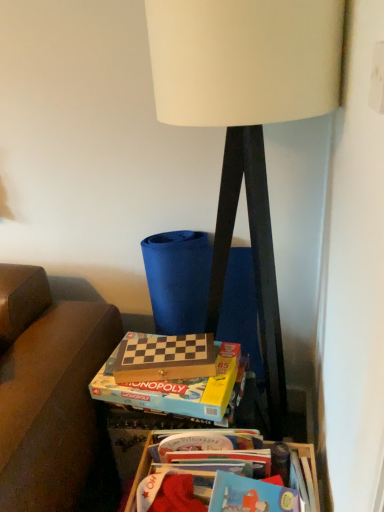
What do you see at coordinates (246, 117) in the screenshot?
I see `white matte lamp at center` at bounding box center [246, 117].

What do you see at coordinates (165, 358) in the screenshot? I see `wooden chess set at lower center, which is the 2th paperback book from front to back` at bounding box center [165, 358].

The image size is (384, 512). Identify the location of wooden at lower right. (140, 472).

In the scene shown: Considering the relative sizes of wooden at lower right and wooden chess set at lower center, which is the 2th paperback book from front to back, in the image provided, is wooden at lower right smaller than wooden chess set at lower center, which is the 2th paperback book from front to back,?

Actually, wooden at lower right might be larger than wooden chess set at lower center, which is the 2th paperback book from front to back.

Looking at this image, from a real-world perspective, is wooden at lower right physically below wooden chess set at lower center, which appears as the first paperback book when viewed from the back?

Yes, from a real-world perspective, wooden at lower right is under wooden chess set at lower center, which appears as the first paperback book when viewed from the back.

Which object is further away from the camera, wooden at lower right or wooden chess set at lower center, which appears as the first paperback book when viewed from the back?

wooden chess set at lower center, which appears as the first paperback book when viewed from the back, is further away from the camera.

Is wooden at lower right to the left of wooden chess set at lower center, which appears as the first paperback book when viewed from the back, from the viewer's perspective?

No, wooden at lower right is not to the left of wooden chess set at lower center, which appears as the first paperback book when viewed from the back.

Considering the relative sizes of white matte lamp at center and wooden at lower right in the image provided, is white matte lamp at center wider than wooden at lower right?

Yes, white matte lamp at center is wider than wooden at lower right.

From a real-world perspective, is white matte lamp at center positioned under wooden at lower right based on gravity?

No, from a real-world perspective, white matte lamp at center is not under wooden at lower right.

From the image's perspective, is white matte lamp at center located beneath wooden at lower right?

Incorrect, from the image's perspective, white matte lamp at center is higher than wooden at lower right.

What's the angular difference between white matte lamp at center and wooden at lower right's facing directions?

white matte lamp at center and wooden at lower right are facing 2.39 degrees away from each other.

Considering the positions of objects white matte lamp at center and wooden chess set at lower center, which appears as the first paperback book when viewed from the back, in the image provided, who is in front, white matte lamp at center or wooden chess set at lower center, which appears as the first paperback book when viewed from the back,?

Result: white matte lamp at center is closer to the camera.

Is white matte lamp at center inside or outside of wooden chess set at lower center, which appears as the first paperback book when viewed from the back?

white matte lamp at center is not inside wooden chess set at lower center, which appears as the first paperback book when viewed from the back, it's outside.

From a real-world perspective, which object stands above the other?

white matte lamp at center.

Between wooden chess set at center, the 1th paperback book in the front-to-back sequence, and white matte lamp at center, which one is positioned in front?

white matte lamp at center is more forward.

Considering the relative sizes of wooden chess set at center, the 1th paperback book in the front-to-back sequence, and white matte lamp at center in the image provided, is wooden chess set at center, the 1th paperback book in the front-to-back sequence, bigger than white matte lamp at center?

No, wooden chess set at center, the 1th paperback book in the front-to-back sequence, is not bigger than white matte lamp at center.

How far apart are wooden chess set at center, the 1th paperback book in the front-to-back sequence, and white matte lamp at center?

The distance of wooden chess set at center, the 1th paperback book in the front-to-back sequence, from white matte lamp at center is 16.75 inches.

Is wooden chess set at center, the 1th paperback book in the front-to-back sequence, taller or shorter than white matte lamp at center?

Considering their sizes, wooden chess set at center, the 1th paperback book in the front-to-back sequence, has less height than white matte lamp at center.

Which of these two, wooden at lower right or wooden chess set at center, the 1th paperback book in the front-to-back sequence, stands taller?

wooden at lower right.

Is the position of wooden at lower right less distant than that of wooden chess set at center, the 1th paperback book in the front-to-back sequence?

Yes, wooden at lower right is in front of wooden chess set at center, the 1th paperback book in the front-to-back sequence.

Considering the relative sizes of wooden at lower right and wooden chess set at center, the 1th paperback book in the front-to-back sequence, in the image provided, is wooden at lower right bigger than wooden chess set at center, the 1th paperback book in the front-to-back sequence,?

Yes, wooden at lower right is bigger than wooden chess set at center, the 1th paperback book in the front-to-back sequence.

Considering the relative positions of wooden at lower right and wooden chess set at center, which ranks as the 2th paperback book in back-to-front order, in the image provided, is wooden at lower right to the right of wooden chess set at center, which ranks as the 2th paperback book in back-to-front order, from the viewer's perspective?

Yes, wooden at lower right is to the right of wooden chess set at center, which ranks as the 2th paperback book in back-to-front order.

Considering the sizes of wooden chess set at center, which ranks as the 2th paperback book in back-to-front order, and wooden at lower right in the image, is wooden chess set at center, which ranks as the 2th paperback book in back-to-front order, bigger or smaller than wooden at lower right?

→ Considering their sizes, wooden chess set at center, which ranks as the 2th paperback book in back-to-front order, takes up less space than wooden at lower right.

Is wooden chess set at center, the 1th paperback book in the front-to-back sequence, next to wooden at lower right and touching it?

No, wooden chess set at center, the 1th paperback book in the front-to-back sequence, is not with wooden at lower right.

Is wooden chess set at center, which ranks as the 2th paperback book in back-to-front order, positioned before wooden at lower right?

No, wooden chess set at center, which ranks as the 2th paperback book in back-to-front order, is further to the viewer.

Who is more distant, white matte lamp at center or wooden chess set at center, which ranks as the 2th paperback book in back-to-front order?

Positioned behind is wooden chess set at center, which ranks as the 2th paperback book in back-to-front order.

From a real-world perspective, does white matte lamp at center stand above wooden chess set at center, which ranks as the 2th paperback book in back-to-front order?

Yes, from a real-world perspective, white matte lamp at center is on top of wooden chess set at center, which ranks as the 2th paperback book in back-to-front order.

Is point (257, 136) more distant than point (167, 408)?

No, it is in front of (167, 408).

This screenshot has width=384, height=512. Find the location of `the 2nd paperback book behind the wooden at lower right, counting from the anchor's position`. the 2nd paperback book behind the wooden at lower right, counting from the anchor's position is located at coordinates [165, 358].

Image resolution: width=384 pixels, height=512 pixels. I want to click on lamp that is on the right side of wooden at lower right, so click(246, 117).

Looking at the image, which one is located further to wooden at lower right, wooden chess set at lower center, which is the 2th paperback book from front to back, or wooden chess set at center, the 1th paperback book in the front-to-back sequence?

wooden chess set at lower center, which is the 2th paperback book from front to back, lies further to wooden at lower right than the other object.

Estimate the real-world distances between objects in this image. Which object is further from wooden chess set at lower center, which appears as the first paperback book when viewed from the back, wooden chess set at center, the 1th paperback book in the front-to-back sequence, or white matte lamp at center?

The object further to wooden chess set at lower center, which appears as the first paperback book when viewed from the back, is white matte lamp at center.

Looking at the image, which one is located closer to wooden at lower right, white matte lamp at center or wooden chess set at center, the 1th paperback book in the front-to-back sequence?

wooden chess set at center, the 1th paperback book in the front-to-back sequence, is positioned closer to the anchor wooden at lower right.

Estimate the real-world distances between objects in this image. Which object is further from white matte lamp at center, wooden chess set at lower center, which appears as the first paperback book when viewed from the back, or wooden at lower right?

wooden at lower right lies further to white matte lamp at center than the other object.

Estimate the real-world distances between objects in this image. Which object is closer to wooden chess set at lower center, which is the 2th paperback book from front to back, white matte lamp at center or wooden at lower right?

Based on the image, wooden at lower right appears to be nearer to wooden chess set at lower center, which is the 2th paperback book from front to back.

Based on their spatial positions, is wooden chess set at lower center, which is the 2th paperback book from front to back, or wooden at lower right further from wooden chess set at center, the 1th paperback book in the front-to-back sequence?

wooden at lower right is further to wooden chess set at center, the 1th paperback book in the front-to-back sequence.

Based on their spatial positions, is wooden at lower right or wooden chess set at lower center, which appears as the first paperback book when viewed from the back, further from wooden chess set at center, which ranks as the 2th paperback book in back-to-front order?

wooden at lower right is positioned further to the anchor wooden chess set at center, which ranks as the 2th paperback book in back-to-front order.

Which object lies further to the anchor point wooden at lower right, wooden chess set at center, which ranks as the 2th paperback book in back-to-front order, or white matte lamp at center?

white matte lamp at center.

Find the location of a particular element. This screenshot has height=512, width=384. paperback book between white matte lamp at center and wooden chess set at lower center, which appears as the first paperback book when viewed from the back, from front to back is located at coordinates (175, 389).

Locate an element on the screen. This screenshot has width=384, height=512. paperback book between wooden chess set at lower center, which appears as the first paperback book when viewed from the back, and wooden at lower right in the up-down direction is located at coordinates (x=175, y=389).